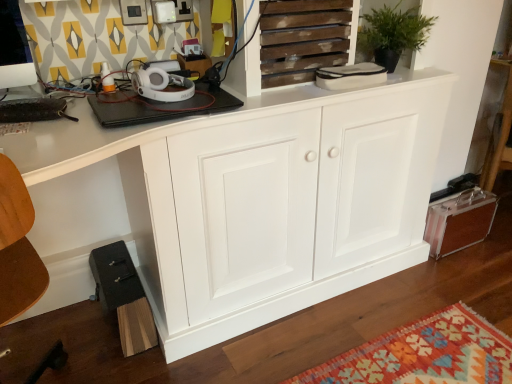
Question: Is white wood cabinet at center, which ranks as the 2th cabinetry in right-to-left order, far from metallic brown suitcase at lower right, which appears as the first cabinetry when viewed from the right?

Choices:
 (A) no
 (B) yes

Answer: (A)

Question: Is the position of white wood cabinet at center, which ranks as the 2th cabinetry in right-to-left order, more distant than that of metallic brown suitcase at lower right, which appears as the first cabinetry when viewed from the right?

Choices:
 (A) no
 (B) yes

Answer: (A)

Question: Considering the relative sizes of white wood cabinet at center, the first cabinetry when ordered from left to right, and metallic brown suitcase at lower right, which appears as the first cabinetry when viewed from the right, in the image provided, is white wood cabinet at center, the first cabinetry when ordered from left to right, thinner than metallic brown suitcase at lower right, which appears as the first cabinetry when viewed from the right,?

Choices:
 (A) no
 (B) yes

Answer: (A)

Question: Is white wood cabinet at center, which ranks as the 2th cabinetry in right-to-left order, directly adjacent to metallic brown suitcase at lower right, which is counted as the 2th cabinetry, starting from the left?

Choices:
 (A) yes
 (B) no

Answer: (B)

Question: Is white wood cabinet at center, which ranks as the 2th cabinetry in right-to-left order, closer to camera compared to metallic brown suitcase at lower right, which appears as the first cabinetry when viewed from the right?

Choices:
 (A) yes
 (B) no

Answer: (A)

Question: Does white wood cabinet at center, which ranks as the 2th cabinetry in right-to-left order, have a lesser height compared to metallic brown suitcase at lower right, which is counted as the 2th cabinetry, starting from the left?

Choices:
 (A) yes
 (B) no

Answer: (B)

Question: Does green matte plant at upper center have a lesser height compared to wooden slats at upper center?

Choices:
 (A) yes
 (B) no

Answer: (A)

Question: From the image's perspective, would you say green matte plant at upper center is shown under wooden slats at upper center?

Choices:
 (A) no
 (B) yes

Answer: (A)

Question: From a real-world perspective, is green matte plant at upper center located higher than wooden slats at upper center?

Choices:
 (A) no
 (B) yes

Answer: (A)

Question: Does green matte plant at upper center come behind wooden slats at upper center?

Choices:
 (A) no
 (B) yes

Answer: (B)

Question: Is green matte plant at upper center facing away from wooden slats at upper center?

Choices:
 (A) no
 (B) yes

Answer: (A)

Question: Is green matte plant at upper center not close to wooden slats at upper center?

Choices:
 (A) yes
 (B) no

Answer: (B)

Question: Can you confirm if wooden slats at upper center is wider than green matte plant at upper center?

Choices:
 (A) no
 (B) yes

Answer: (A)